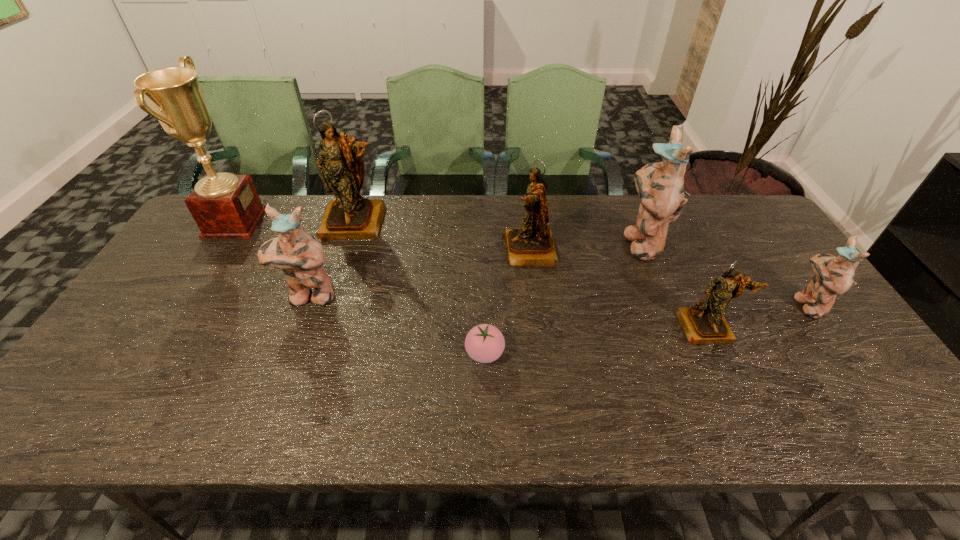
The width and height of the screenshot is (960, 540). I want to click on the nearest gold figurine, so click(704, 322).

The image size is (960, 540). In order to click on the smallest gold figurine in this screenshot , I will do `click(704, 322)`.

I want to click on the shortest object, so click(484, 343).

Locate an element on the screen. tomato is located at coordinates (484, 343).

Where is `blank space located on the plaque of the trophy cup`? The width and height of the screenshot is (960, 540). blank space located on the plaque of the trophy cup is located at coordinates (367, 222).

Locate an element on the screen. This screenshot has width=960, height=540. free region located on the front-facing side of the farthest pink figurine is located at coordinates (587, 242).

This screenshot has height=540, width=960. In order to click on vacant region located on the front-facing side of the farthest pink figurine in this screenshot , I will do `click(596, 242)`.

I want to click on free location located on the front-facing side of the farthest pink figurine, so click(x=519, y=242).

Find the location of a particular element. The image size is (960, 540). vacant space located 0.220m on the front-facing side of the biggest gold figurine is located at coordinates (332, 294).

Locate an element on the screen. The image size is (960, 540). vacant space located 0.370m on the front-facing side of the fourth object from right to left is located at coordinates (382, 251).